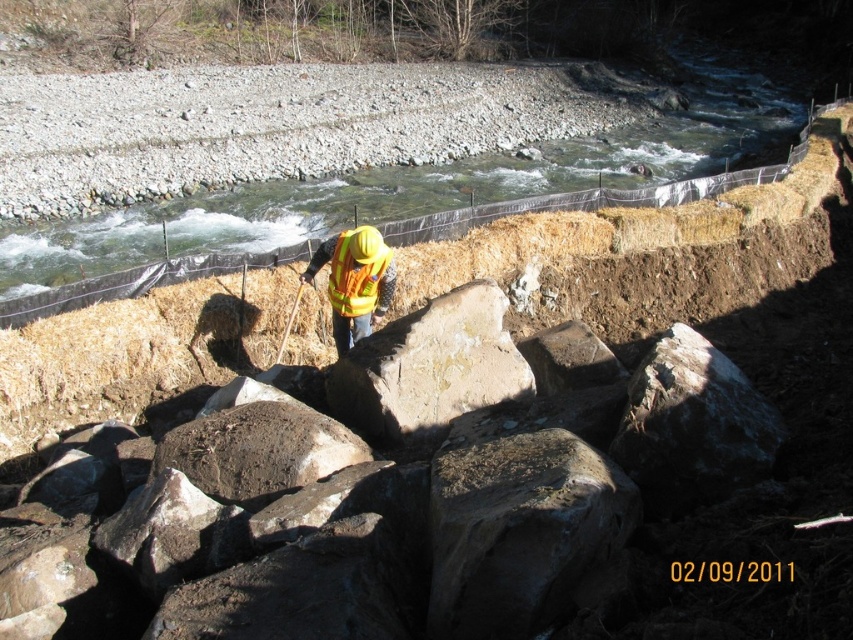
Question: Which object is farther from the camera taking this photo?

Choices:
 (A) high visibility fabric safety vest at center
 (B) slate gray rock at center
 (C) smooth gray rock at center
 (D) reflective yellow safety vest at center

Answer: (D)

Question: Does rusty metallic rock at center appear under reflective yellow safety vest at center?

Choices:
 (A) yes
 (B) no

Answer: (A)

Question: Which point appears farthest from the camera in this image?

Choices:
 (A) (641, 467)
 (B) (358, 253)
 (C) (550, 442)
 (D) (416, 426)

Answer: (B)

Question: From the image, what is the correct spatial relationship of smooth gray rock at center in relation to reflective yellow safety vest at center?

Choices:
 (A) left
 (B) right

Answer: (B)

Question: Among these objects, which one is nearest to the camera?

Choices:
 (A) slate gray rock at center
 (B) smooth gray rock at center

Answer: (A)

Question: Does rusty metallic rock at center appear under reflective yellow safety vest at center?

Choices:
 (A) yes
 (B) no

Answer: (A)